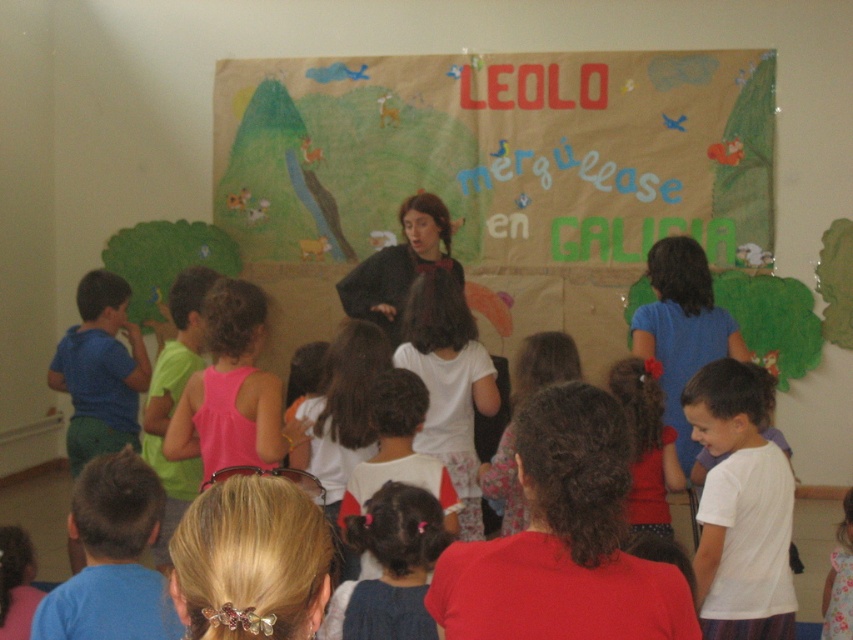
You are a student in the classroom and want to read the text on the brown paper banner at center. Can you read it clearly from where you are standing?

The brown paper banner at center is 6.77 meters away from the viewer. At this distance, it might be challenging to read the text clearly without moving closer.

You are a student in the classroom and want to move from the point at coordinates point (242, 120) to the point at coordinates point (381, 256). Can you walk directly between them without any obstacles?

Point (242, 120) is behind point (381, 256), so you cannot walk directly between them without passing behind point (381, 256) first.